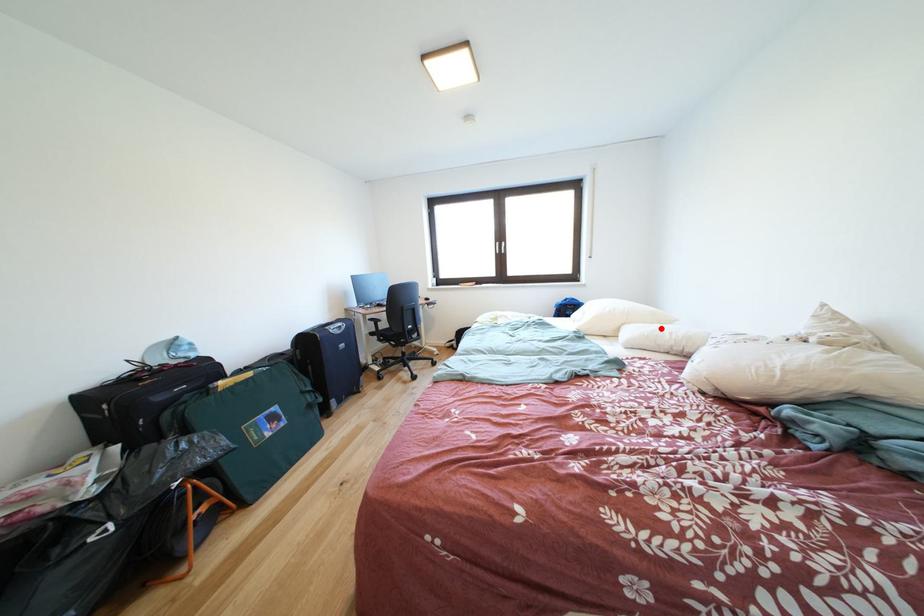
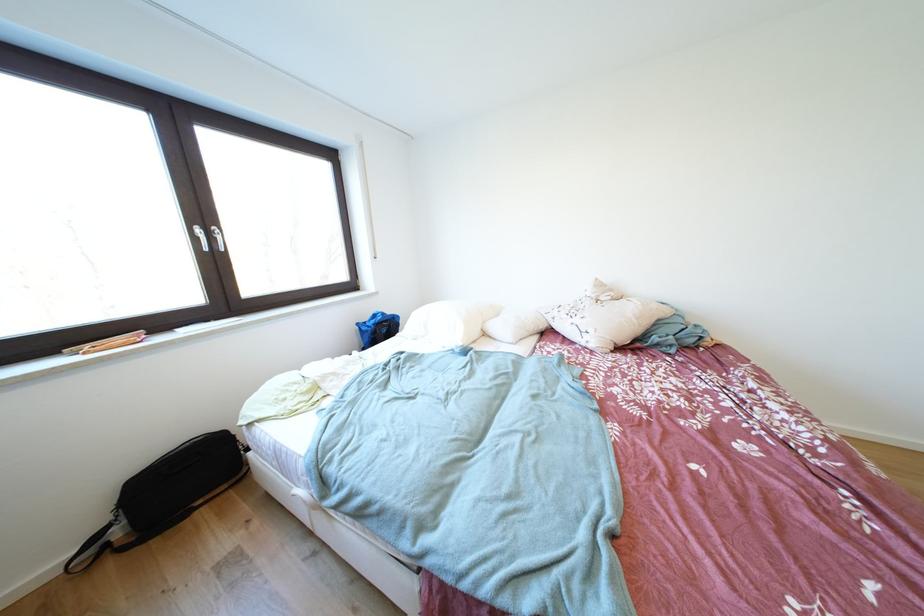
Find the pixel in the second image that matches the highlighted location in the first image.

(505, 320)